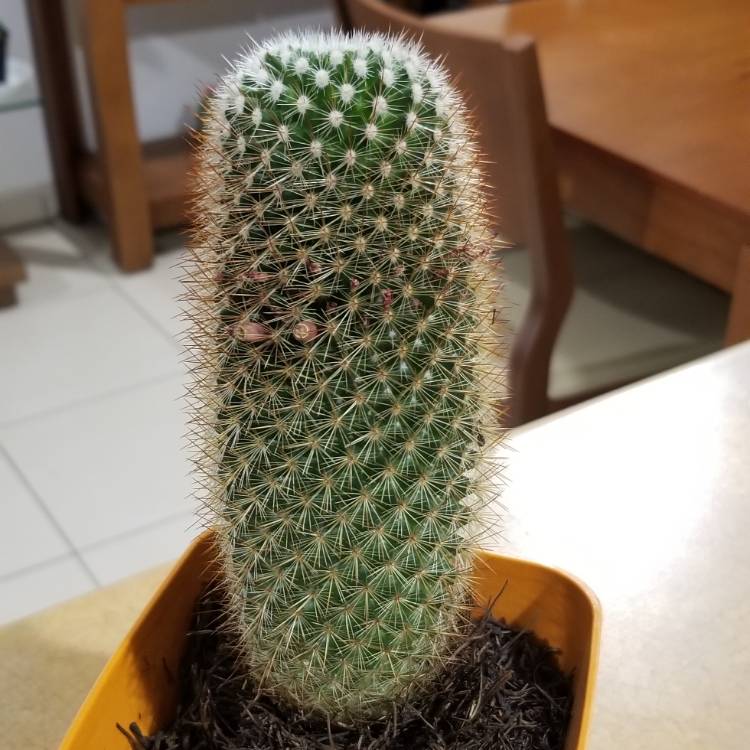
This screenshot has width=750, height=750. Identify the location of pot. (549, 594).